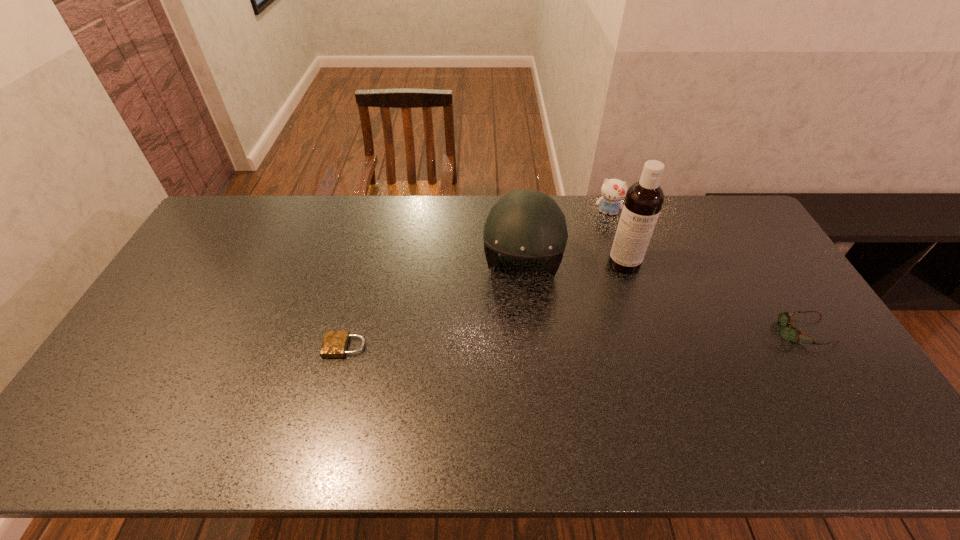
Locate an element on the screen. blank region between the fourth object from right to left and the rightmost object is located at coordinates (660, 300).

Where is `free space between the tallest object and the rightmost object`? The image size is (960, 540). free space between the tallest object and the rightmost object is located at coordinates (711, 298).

Where is `free space between the spectacles and the leftmost object`? free space between the spectacles and the leftmost object is located at coordinates (572, 339).

In order to click on the fourth closest object to the third shortest object in this screenshot , I will do `click(335, 343)`.

Locate an element on the screen. The width and height of the screenshot is (960, 540). object that is the third closest one to the shortest object is located at coordinates [x=613, y=191].

Find the location of a particular element. vacant area that satisfies the following two spatial constraints: 1. on the front side of the kitten; 2. on the front-facing side of the rightmost object is located at coordinates (646, 332).

Where is `vacant space that satisfies the following two spatial constraints: 1. on the front side of the spectacles; 2. on the front-facing side of the kitten`? The height and width of the screenshot is (540, 960). vacant space that satisfies the following two spatial constraints: 1. on the front side of the spectacles; 2. on the front-facing side of the kitten is located at coordinates (646, 332).

Where is `vacant space that satisfies the following two spatial constraints: 1. on the back side of the second object from left to right; 2. on the left side of the third shortest object`? vacant space that satisfies the following two spatial constraints: 1. on the back side of the second object from left to right; 2. on the left side of the third shortest object is located at coordinates (517, 213).